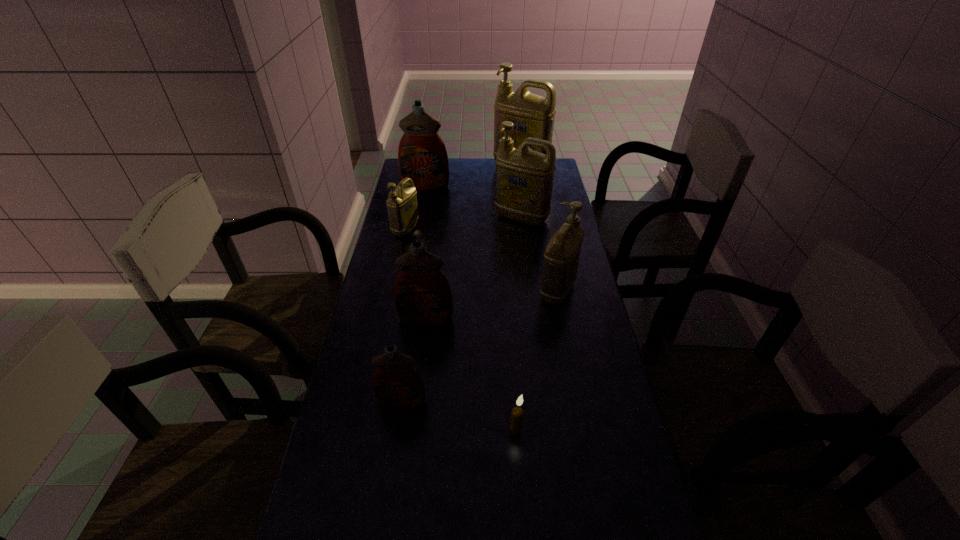
Find the location of a particular element. object located at the far left corner is located at coordinates (422, 156).

I want to click on object situated at the far right corner, so click(533, 116).

Image resolution: width=960 pixels, height=540 pixels. I want to click on vacant space at the far edge of the desktop, so 449,184.

The height and width of the screenshot is (540, 960). What are the coordinates of `vacant space at the left edge of the desktop` in the screenshot? It's located at (361, 423).

You are a GUI agent. You are given a task and a screenshot of the screen. Output one action in this format:
    pyautogui.click(x=<x>, y=<y>)
    Task: Click on the free space at the right edge of the desktop
    The image size is (960, 540).
    Given the screenshot: What is the action you would take?
    pyautogui.click(x=573, y=415)

The width and height of the screenshot is (960, 540). Find the location of `free space between the nearest beige detergent and the second smallest red detergent`. free space between the nearest beige detergent and the second smallest red detergent is located at coordinates (492, 305).

Find the location of `vacant space in between the shortest object and the leftmost beige detergent`. vacant space in between the shortest object and the leftmost beige detergent is located at coordinates (461, 328).

Image resolution: width=960 pixels, height=540 pixels. I want to click on free area in between the biggest beige detergent and the second farthest red detergent, so click(473, 244).

At what (x,y) coordinates should I click in order to perform the action: click on free space between the second smallest beige detergent and the tallest detergent. Please return your answer as a coordinate pair (x, y). The height and width of the screenshot is (540, 960). Looking at the image, I should click on (540, 230).

You are a GUI agent. You are given a task and a screenshot of the screen. Output one action in this format:
    pyautogui.click(x=<x>, y=<y>)
    Task: Click on the empty location between the tallest object and the cream candle
    
    Given the screenshot: What is the action you would take?
    pyautogui.click(x=518, y=298)